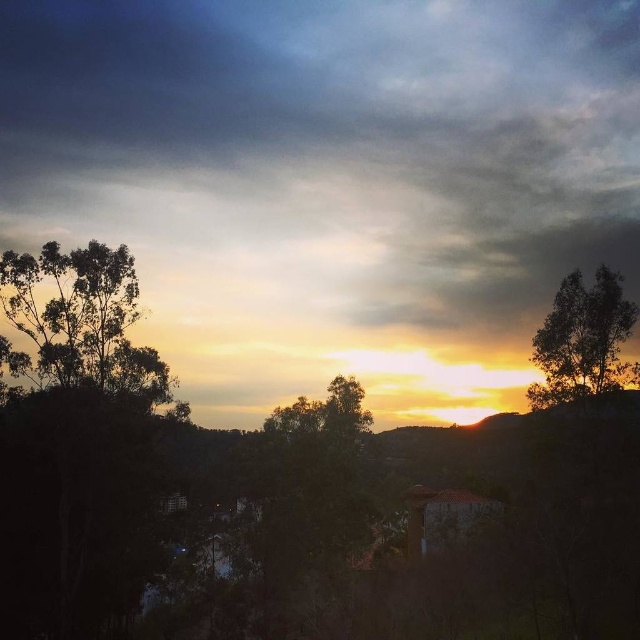
You are standing at the center of the image and want to walk towards the green leafy tree at left. Which direction should you face to move directly towards it?

The green leafy tree at left is located at point coordinates that are to the left of the center. Therefore, you should face towards the left direction to move directly towards the green leafy tree at left.

You are an artist sketching the sunset scene. You notice the green leafy tree at left and the silhouette leafy tree at upper right. Which tree is closer to the base of the canvas?

The green leafy tree at left is positioned under the silhouette leafy tree at upper right, meaning it is closer to the base of the canvas.